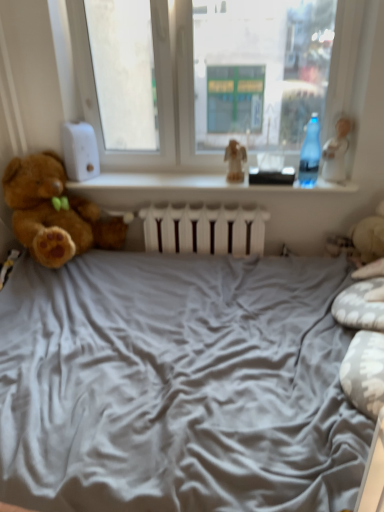
Locate an element on the screen. The image size is (384, 512). vacant space behind matte brown figurine at center, the 1th toy from the left is located at coordinates (235, 169).